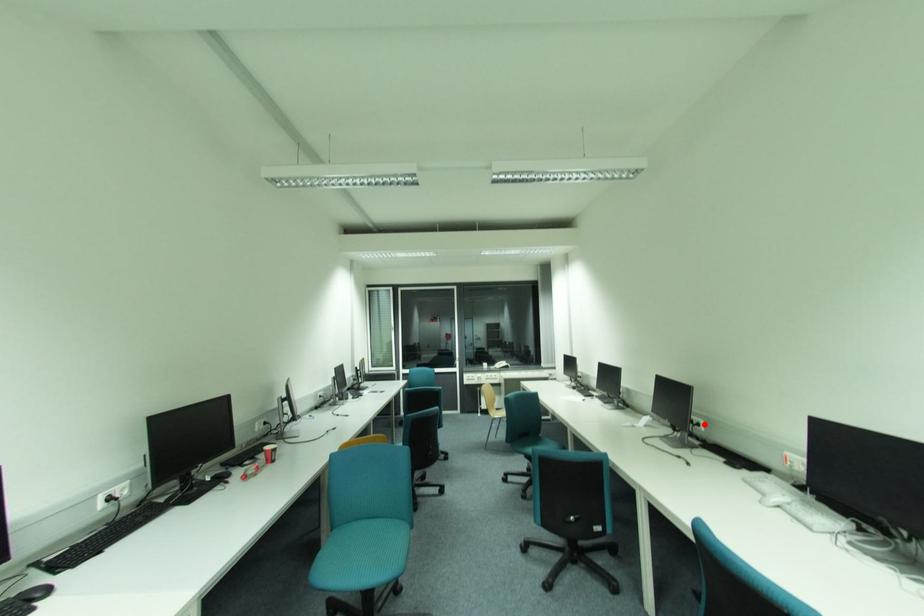
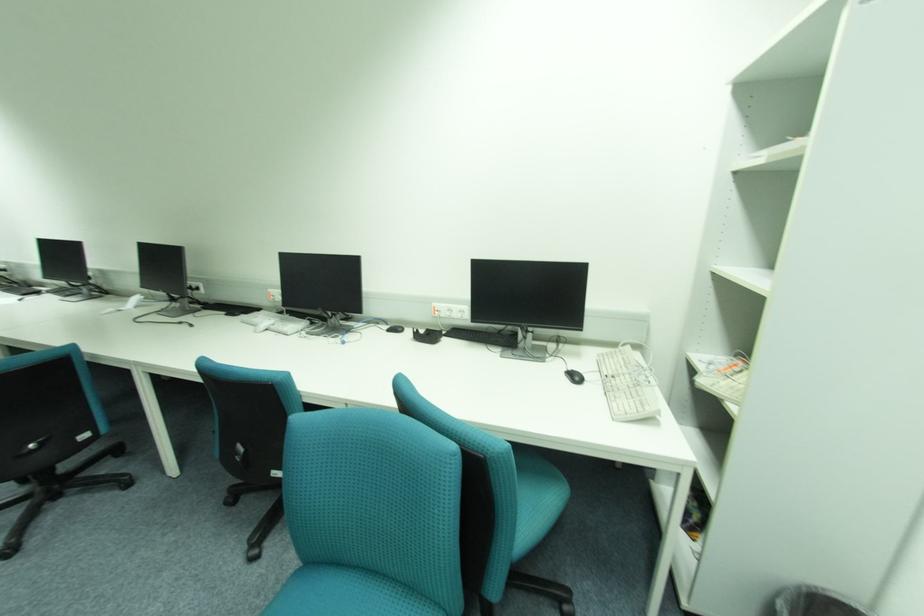
Question: I am providing you with two images of the same scene from different viewpoints. In image1, a red point is highlighted. Considering the same 3D point in image2, which of the following is correct?

Choices:
 (A) It is closer
 (B) It is farther

Answer: (A)